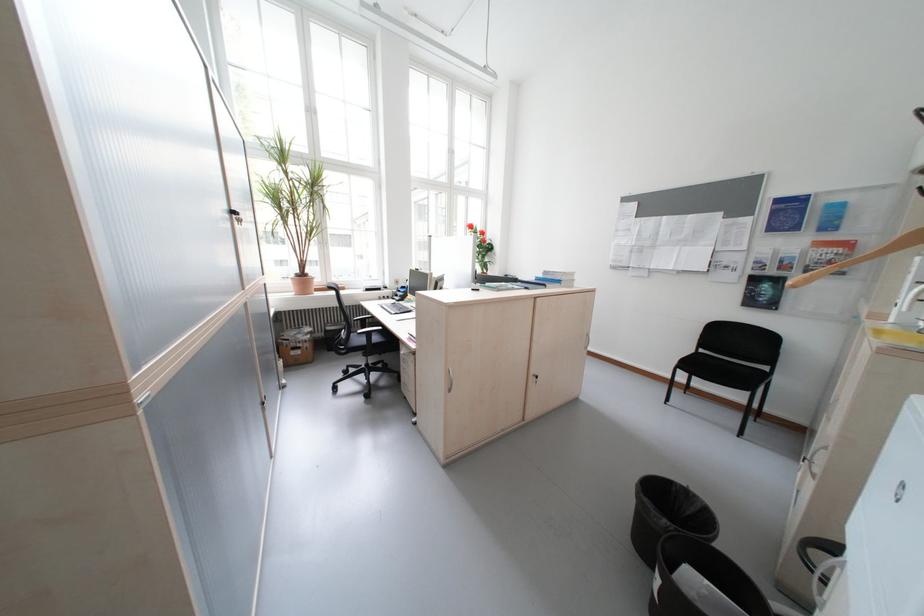
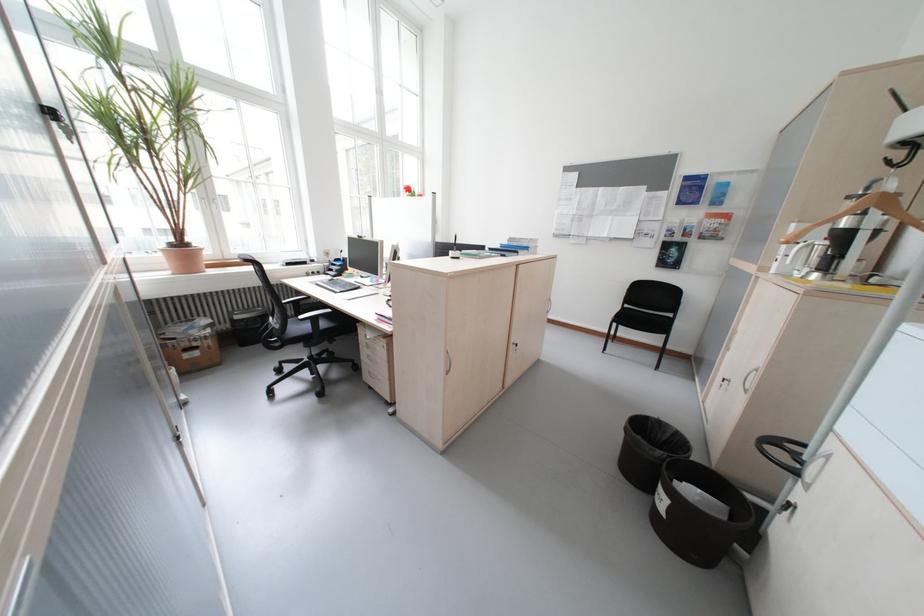
Which direction would the cameraman need to move to produce the second image?

The movement direction of the cameraman is left, forward.